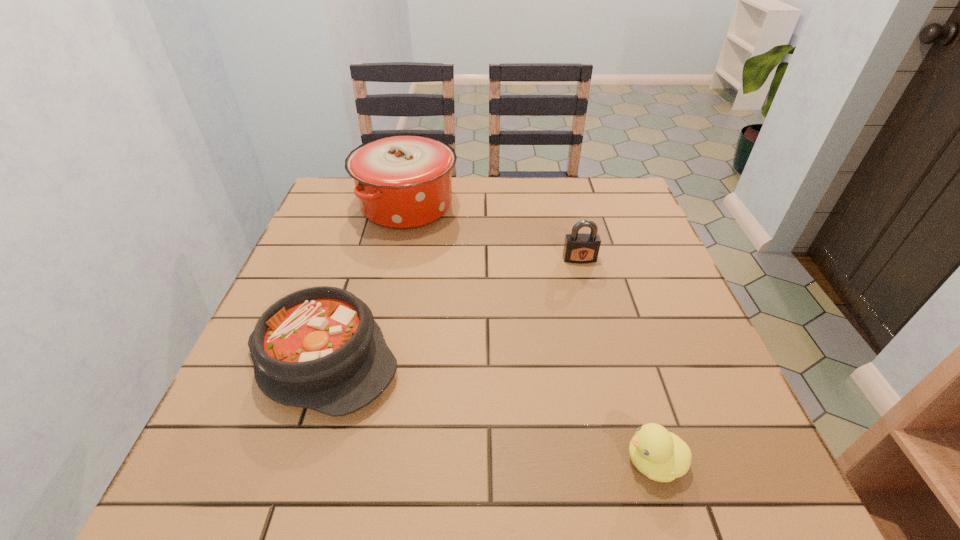
The image size is (960, 540). In order to click on the tallest object in this screenshot , I will do `click(403, 181)`.

Identify the location of the taller casserole. (403, 181).

Find the location of a particular element. Image resolution: width=960 pixels, height=540 pixels. the second farthest object is located at coordinates (580, 248).

Identify the location of the second nearest object. The image size is (960, 540). (320, 348).

Where is `the nearer casserole`? The height and width of the screenshot is (540, 960). the nearer casserole is located at coordinates (320, 348).

At what (x,y) coordinates should I click in order to perform the action: click on the nearest object. Please return your answer as a coordinate pair (x, y). The width and height of the screenshot is (960, 540). Looking at the image, I should click on (662, 456).

Where is `duckling`? The width and height of the screenshot is (960, 540). duckling is located at coordinates (662, 456).

Identify the location of free space located on the right of the tallest object. The height and width of the screenshot is (540, 960). (500, 206).

Where is `free space located on the front of the second farthest object near the keyhole`? The width and height of the screenshot is (960, 540). free space located on the front of the second farthest object near the keyhole is located at coordinates (586, 284).

The width and height of the screenshot is (960, 540). What are the coordinates of `blank space located on the right of the nearer casserole` in the screenshot? It's located at (x=563, y=360).